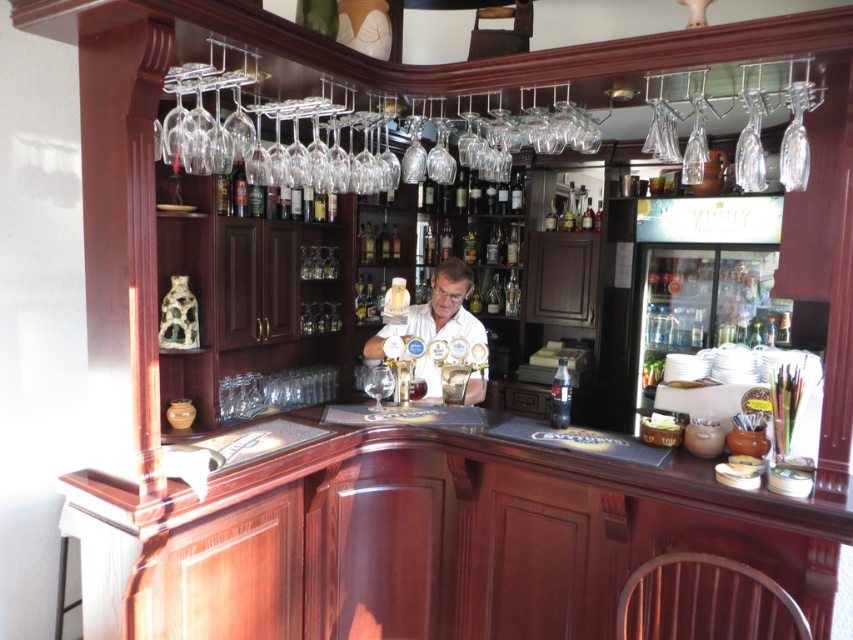
Does clear plastic bottle at center have a lesser width compared to transparent glass wine glass at center?

Correct, clear plastic bottle at center's width is less than transparent glass wine glass at center's.

Who is positioned more to the left, clear plastic bottle at center or transparent glass wine glass at center?

transparent glass wine glass at center

Measure the distance between point (x=555, y=419) and camera.

They are 7.89 feet apart.

In order to click on clear plastic bottle at center in this screenshot , I will do `click(560, 396)`.

Can you confirm if white matte shirt at center is smaller than transparent glass wine glass at center?

No, white matte shirt at center is not smaller than transparent glass wine glass at center.

Does white matte shirt at center appear under transparent glass wine glass at center?

No.

The image size is (853, 640). What do you see at coordinates (436, 310) in the screenshot?
I see `white matte shirt at center` at bounding box center [436, 310].

At what (x,y) coordinates should I click in order to perform the action: click on white matte shirt at center. Please return your answer as a coordinate pair (x, y). Looking at the image, I should click on (436, 310).

Which is more to the right, white matte shirt at center or clear plastic bottle at center?

From the viewer's perspective, clear plastic bottle at center appears more on the right side.

Which is behind, point (450, 314) or point (549, 420)?

Point (450, 314)

You are a GUI agent. You are given a task and a screenshot of the screen. Output one action in this format:
    pyautogui.click(x=<x>, y=<y>)
    Task: Click on the white matte shirt at center
    This screenshot has height=640, width=853.
    Given the screenshot: What is the action you would take?
    pyautogui.click(x=436, y=310)

The image size is (853, 640). Identify the location of white matte shirt at center. pos(436,310).